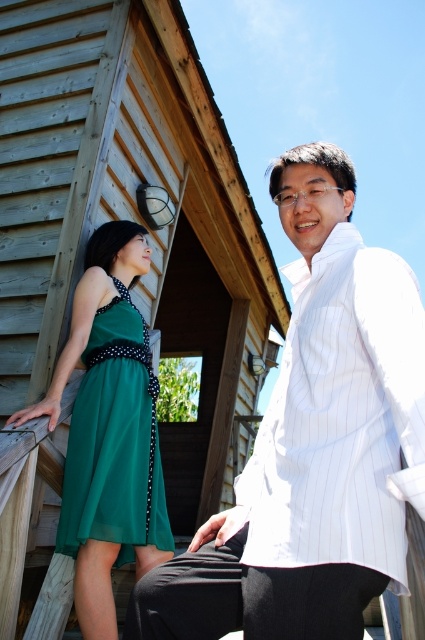
Question: Which of the following is the closest to the observer?

Choices:
 (A) green chiffon dress at left
 (B) wooden hut at upper left

Answer: (A)

Question: Can you confirm if wooden hut at upper left is positioned below green chiffon dress at left?

Choices:
 (A) yes
 (B) no

Answer: (B)

Question: Does white striped shirt at right have a greater width compared to green chiffon dress at left?

Choices:
 (A) no
 (B) yes

Answer: (B)

Question: Which point appears closest to the camera in this image?

Choices:
 (A) (387, 378)
 (B) (25, 477)

Answer: (A)

Question: Is wooden hut at upper left smaller than green chiffon dress at left?

Choices:
 (A) yes
 (B) no

Answer: (A)

Question: Considering the real-world distances, which object is closest to the wooden hut at upper left?

Choices:
 (A) green chiffon dress at left
 (B) white striped shirt at right

Answer: (A)